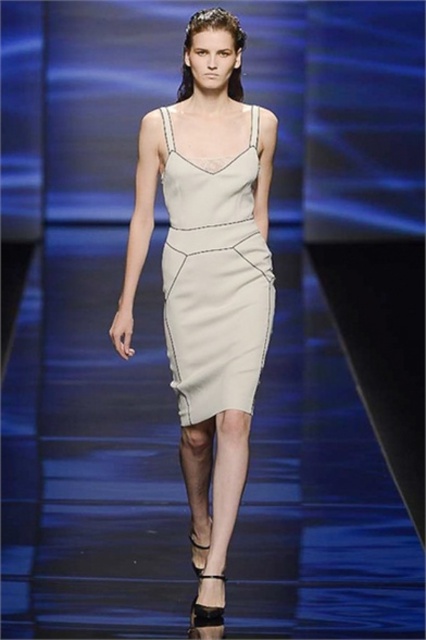
You are a photographer at the runway show. You notice two satin dresses at the center of the image. Which one is closer to you, the satin dress at center or the satin beige dress at center?

The satin dress at center is closer to you because it is in front of the satin beige dress at center.

From the picture: What is located at the coordinates point (207,276) in the runway scene?

The satin dress at center is located at point (207,276).

You are a photographer at the runway show and want to capture the model wearing the satin dress at center and the satin beige dress at center. Which dress should you focus on if you want to photograph the one that is more to the left?

The satin dress at center is more to the left than the satin beige dress at center, so you should focus on the satin dress at center.